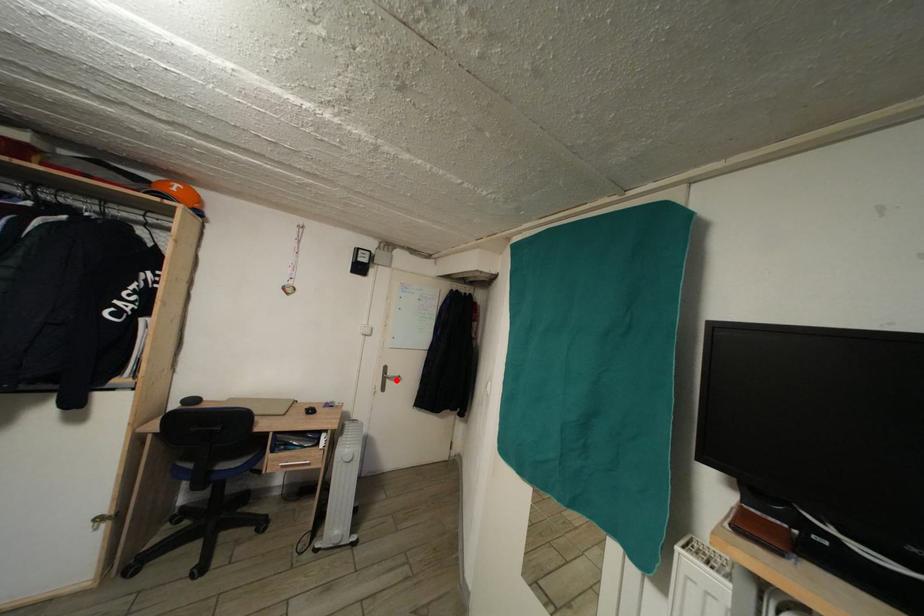
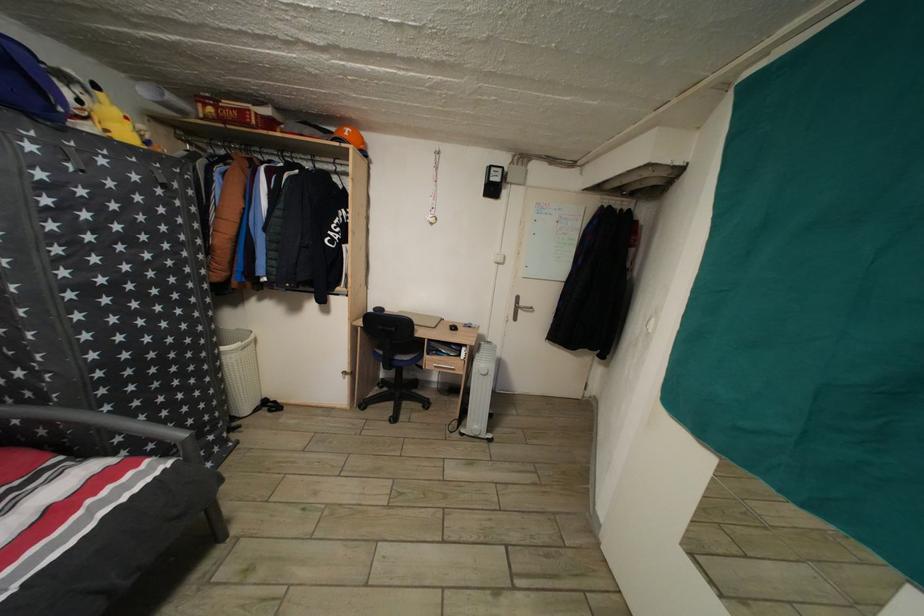
The point at the highlighted location is marked in the first image. Where is the corresponding point in the second image?

(529, 310)